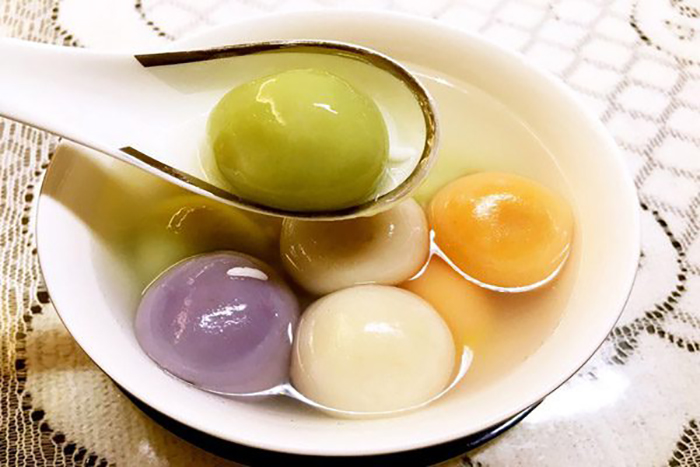
The image size is (700, 467). Identify the location of edge of bowl. (104, 375).